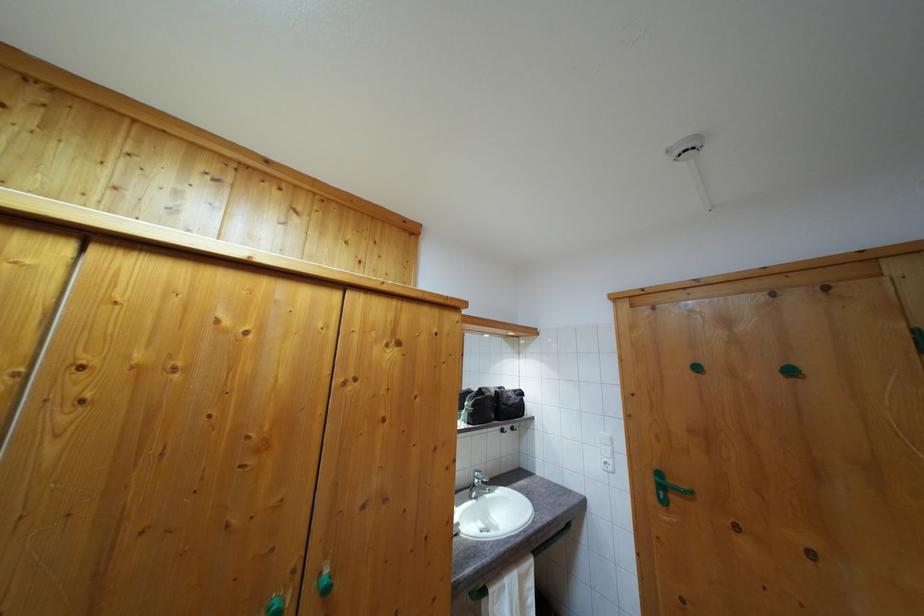
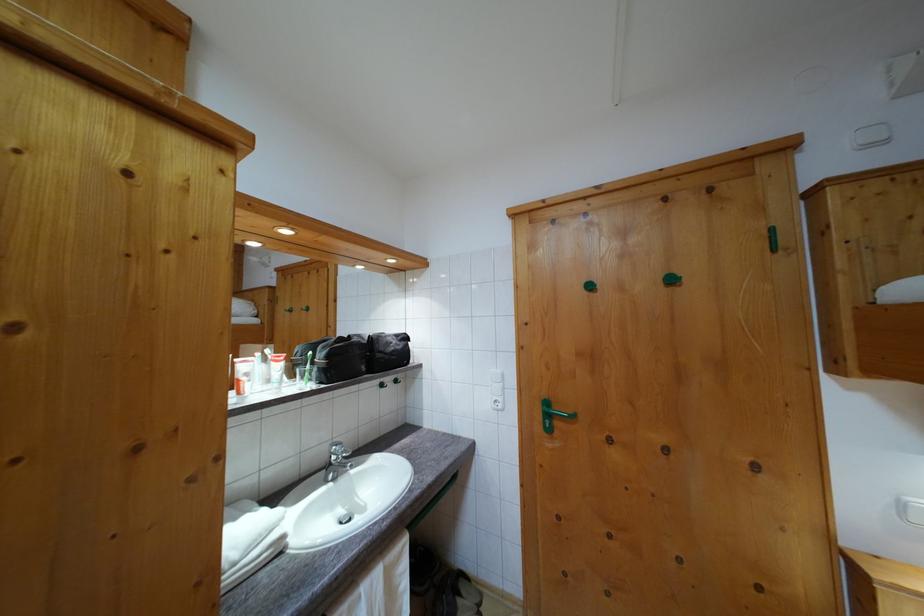
In a continuous first-person perspective shot, in which direction is the camera moving?

The cameraman walked toward right, forward.